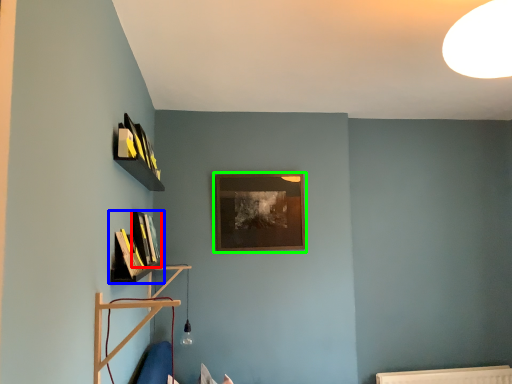
Question: Estimate the real-world distances between objects in this image. Which object is closer to book (highlighted by a red box), shelf (highlighted by a blue box) or picture frame (highlighted by a green box)?

Choices:
 (A) shelf
 (B) picture frame

Answer: (A)